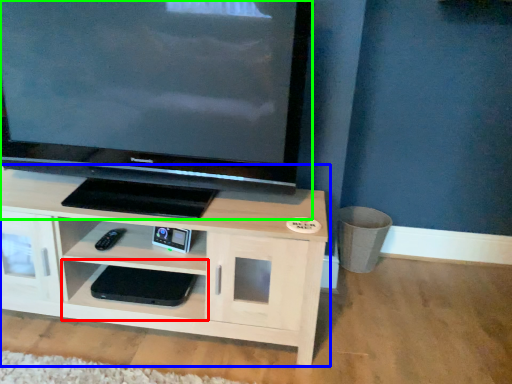
Question: Which object is the closest to the shelf (highlighted by a red box)? Choose among these: shelf (highlighted by a blue box) or television (highlighted by a green box).

Choices:
 (A) shelf
 (B) television

Answer: (A)